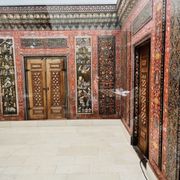
I want to click on trim around doors, so click(137, 70), click(67, 80), click(24, 74).